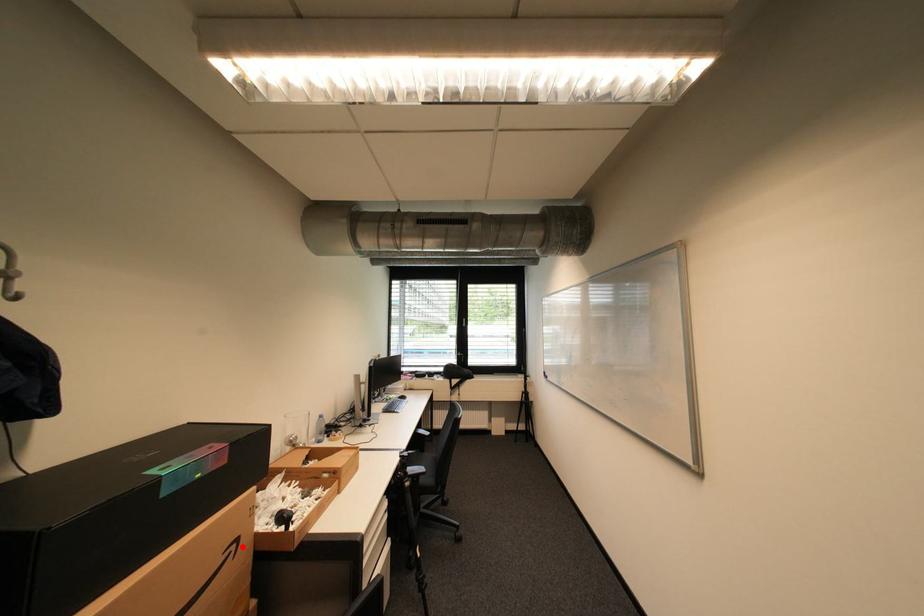
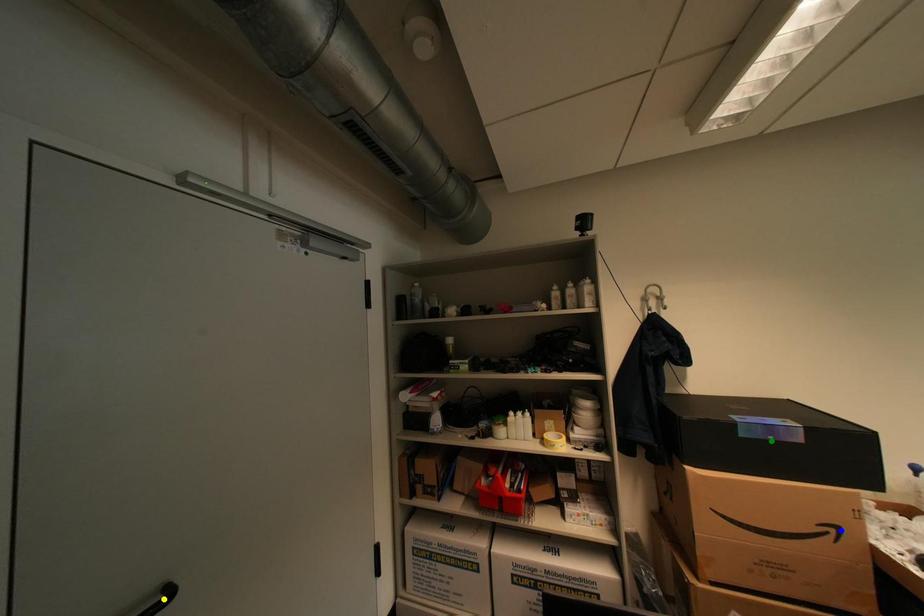
Question: I am providing you with two images of the same scene from different viewpoints. A red point is marked on the first image. You are given multiple points on the second image. Can you choose the point in image 2 that corresponds to the point in image 1?

Choices:
 (A) blue point
 (B) yellow point
 (C) green point

Answer: (A)